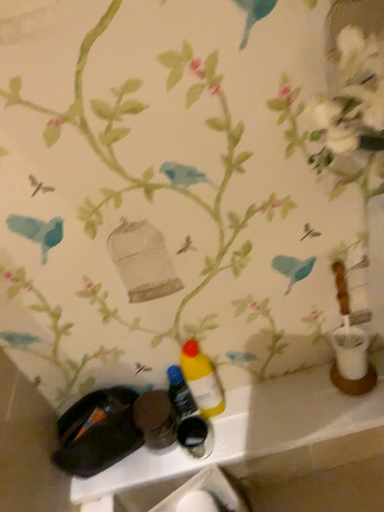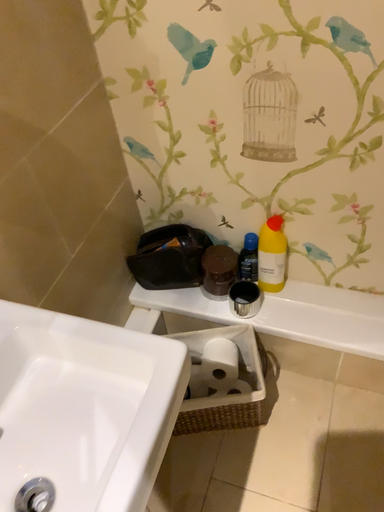
Question: How did the camera likely rotate when shooting the video?

Choices:
 (A) rotated upward
 (B) rotated downward

Answer: (B)